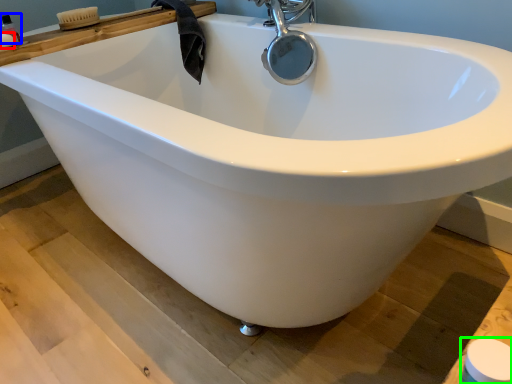
Question: Estimate the real-world distances between objects in this image. Which object is farther from soap (highlighted by a red box), toiletry (highlighted by a blue box) or toilet paper (highlighted by a green box)?

Choices:
 (A) toiletry
 (B) toilet paper

Answer: (B)